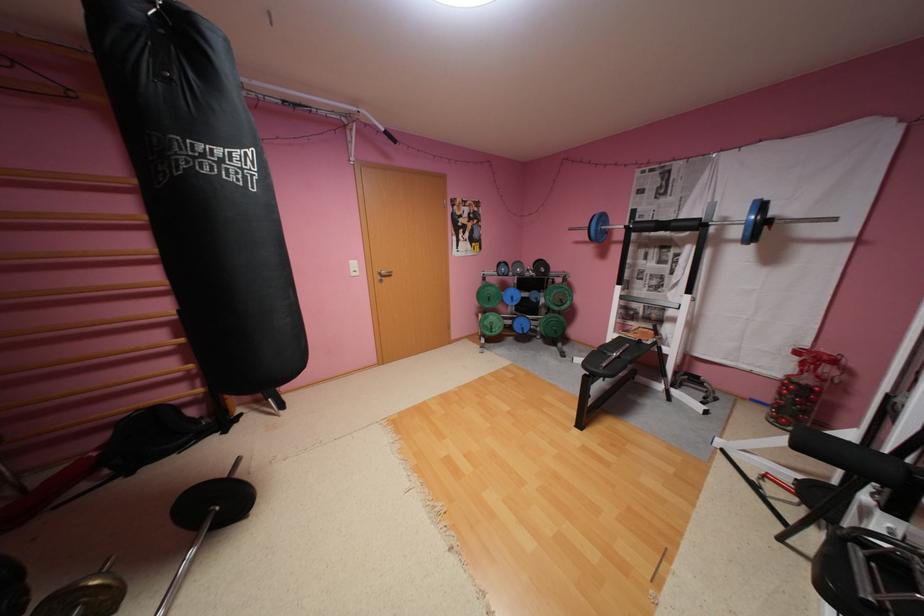
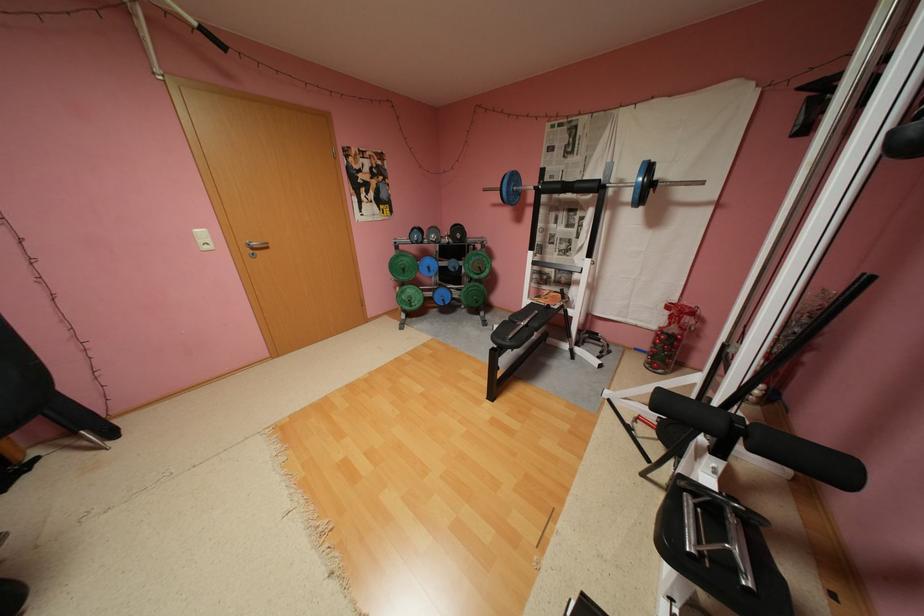
In the second image, find the point that corresponds to (867,551) in the first image.

(699, 500)